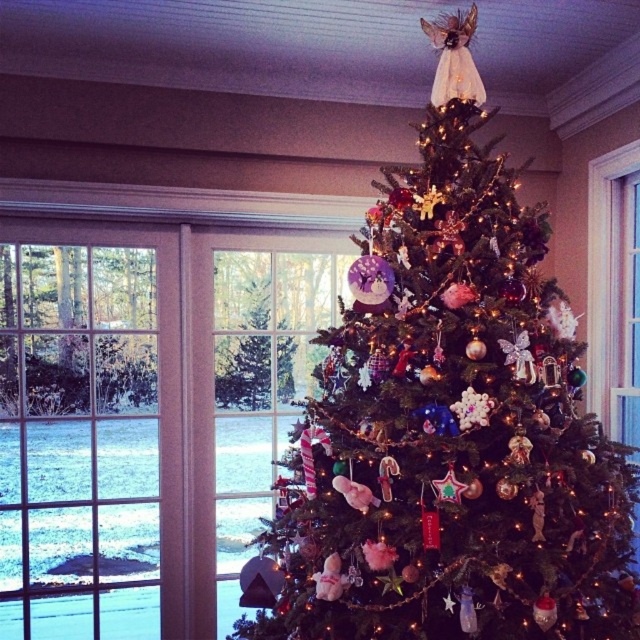
Which of these two, shiny green tree at center or clear glass window at center, stands shorter?

clear glass window at center is shorter.

Is shiny green tree at center to the left of clear glass window at center from the viewer's perspective?

Incorrect, shiny green tree at center is not on the left side of clear glass window at center.

Measure the distance between shiny green tree at center and camera.

shiny green tree at center is 5.34 feet away from camera.

Locate an element on the screen. This screenshot has height=640, width=640. shiny green tree at center is located at coordinates (449, 422).

In the scene shown: Can you confirm if clear glass window at center is positioned to the left of green matte tree at center?

Yes, clear glass window at center is to the left of green matte tree at center.

Which is behind, point (150, 276) or point (252, 337)?

The point (252, 337) is more distant.

This screenshot has width=640, height=640. I want to click on clear glass window at center, so click(x=132, y=397).

Find the location of a particular element. The width and height of the screenshot is (640, 640). shiny green tree at center is located at coordinates (449, 422).

Who is positioned more to the left, shiny green tree at center or green matte tree at center?

Positioned to the left is green matte tree at center.

You are a GUI agent. You are given a task and a screenshot of the screen. Output one action in this format:
    pyautogui.click(x=<x>, y=<y>)
    Task: Click on the shiny green tree at center
    The height and width of the screenshot is (640, 640).
    Given the screenshot: What is the action you would take?
    pyautogui.click(x=449, y=422)